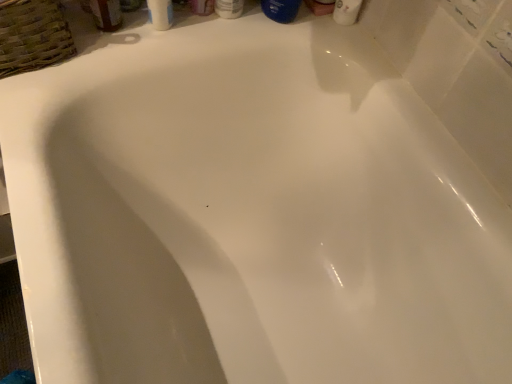
Locate an element on the screen. The image size is (512, 384). free location to the left of blue glossy bottle at upper center, the second mouthwash in the left-to-right sequence is located at coordinates (198, 24).